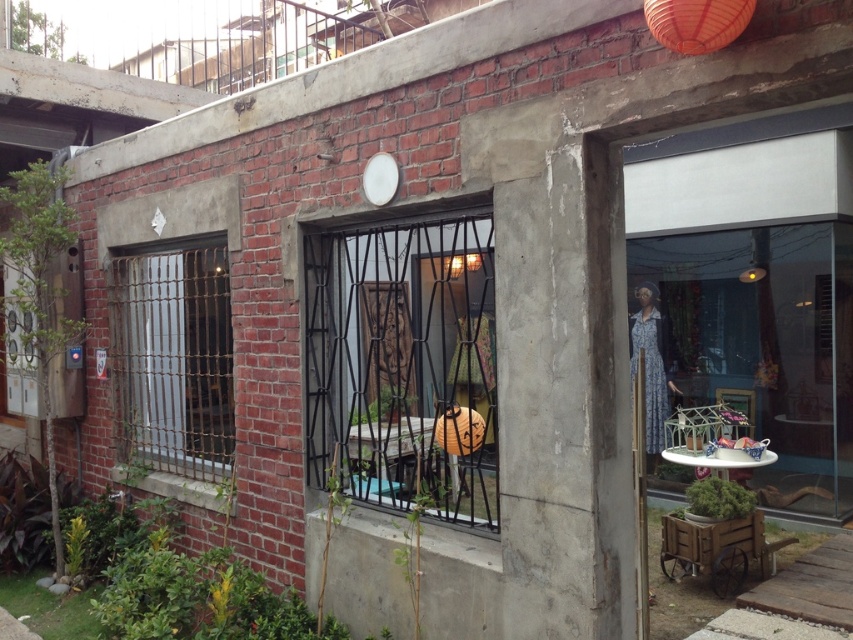
Is black metal gate at center positioned at the back of orange paper lantern at center?

Yes, it is.

Which is more to the left, black metal gate at center or orange paper lantern at center?

black metal gate at center

Image resolution: width=853 pixels, height=640 pixels. I want to click on black metal gate at center, so click(x=402, y=362).

Which of these two, black metal gate at center or orange matte paper lantern at upper center, stands shorter?

orange matte paper lantern at upper center is shorter.

Does black metal gate at center appear on the left side of orange matte paper lantern at upper center?

Indeed, black metal gate at center is positioned on the left side of orange matte paper lantern at upper center.

The height and width of the screenshot is (640, 853). Describe the element at coordinates (402, 362) in the screenshot. I see `black metal gate at center` at that location.

What are the coordinates of `black metal gate at center` in the screenshot? It's located at (402, 362).

Does orange matte paper lantern at upper center have a smaller size compared to orange paper lantern at center?

Indeed, orange matte paper lantern at upper center has a smaller size compared to orange paper lantern at center.

Is point (740, 22) farther from camera compared to point (438, 433)?

No, (740, 22) is in front of (438, 433).

At what (x,y) coordinates should I click in order to perform the action: click on orange matte paper lantern at upper center. Please return your answer as a coordinate pair (x, y). The height and width of the screenshot is (640, 853). Looking at the image, I should click on (695, 22).